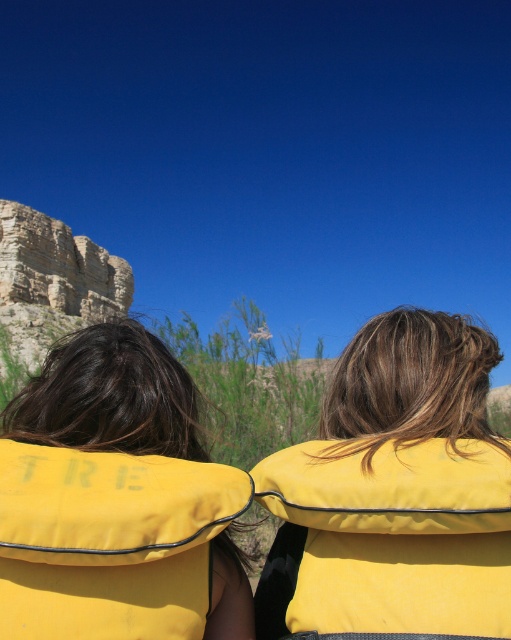
You are a hiker who needs to choose between the yellow fabric life vest at center and the yellow fabric life jacket at center for a water activity. Which one is taller?

The yellow fabric life vest at center is taller than the yellow fabric life jacket at center.

You are a hiker who needs to choose between the yellow fabric life vest at center and the yellow fabric life jacket at upper center for a water activity. Which one is wider?

The yellow fabric life vest at center is wider than the yellow fabric life jacket at upper center.